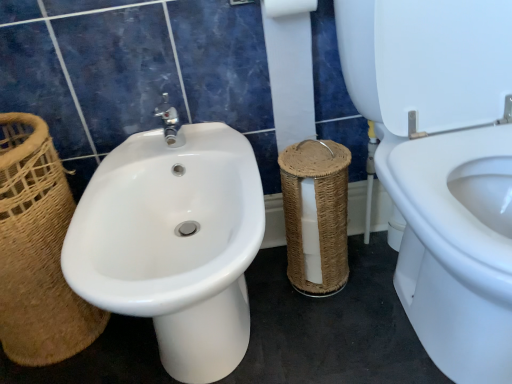
Question: Is white paper at center situated inside brown wicker basket at left or outside?

Choices:
 (A) outside
 (B) inside

Answer: (A)

Question: Considering the positions of white paper at center and brown wicker basket at left in the image, is white paper at center wider or thinner than brown wicker basket at left?

Choices:
 (A) wide
 (B) thin

Answer: (B)

Question: Estimate the real-world distances between objects in this image. Which object is farther from the white paper at center?

Choices:
 (A) brown wicker basket at left
 (B) white glossy bidet at left
 (C) white glossy bidet at center
 (D) woven brown basket at center

Answer: (A)

Question: Based on their relative distances, which object is nearer to the white glossy bidet at left?

Choices:
 (A) brown wicker basket at left
 (B) white glossy bidet at center
 (C) white paper at center
 (D) woven brown basket at center

Answer: (D)